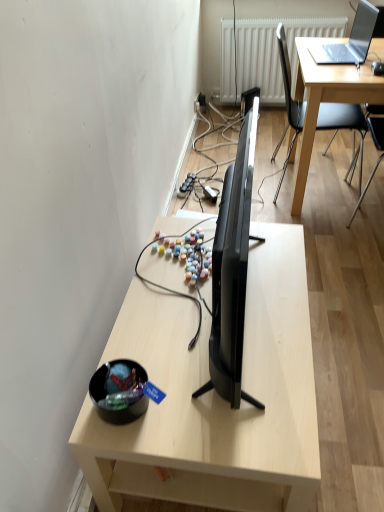
The width and height of the screenshot is (384, 512). I want to click on vacant space positioned to the left of black glossy tv at center, so click(x=163, y=317).